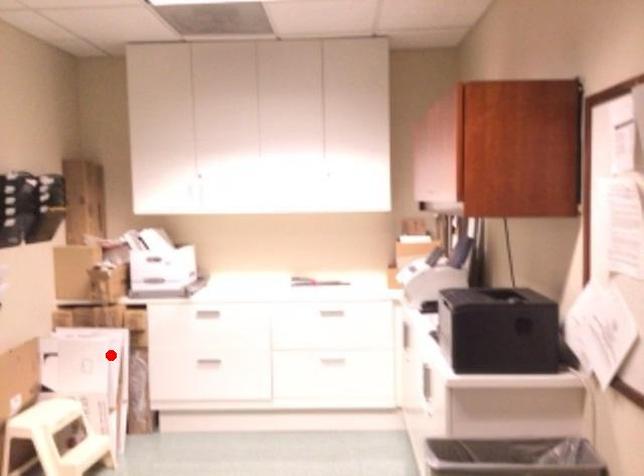
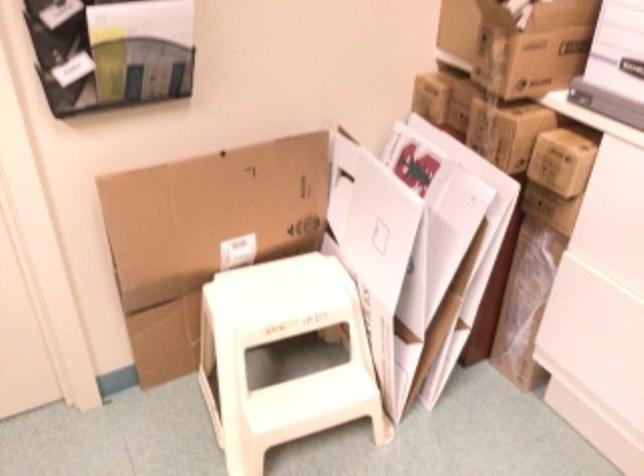
Question: I am providing you with two images of the same scene from different viewpoints. Given a red point in image1, look at the same physical point in image2. Is it:

Choices:
 (A) Closer to the viewpoint
 (B) Farther from the viewpoint

Answer: (A)